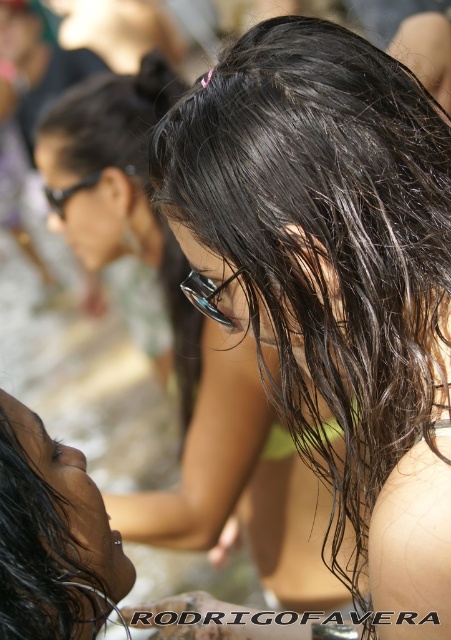
You are a photographer trying to capture a closeup of the clear plastic goggles at center and the white matte bikini top at center. Which object should you zoom in on to ensure both fit in the frame without cropping?

The clear plastic goggles at center has a lesser width compared to white matte bikini top at center, so you should zoom in on the white matte bikini top at center to ensure both objects fit in the frame without cropping.

You are a photographer trying to capture both the shiny black hair at lower left and the clear plastic goggles at center in a single frame. Which object should you focus on first if you want to ensure both are in focus, considering their sizes?

The shiny black hair at lower left is larger in size than the clear plastic goggles at center, so you should focus on the shiny black hair at lower left first to ensure both are in focus.

You are a photographer trying to capture a candid shot of the shiny black hair at lower left and the clear plastic goggles at center. The camera has a focus range of 12 inches. Can you fit both objects in the frame without moving the camera?

The shiny black hair at lower left and clear plastic goggles at center are 12.59 inches apart, which is slightly beyond the camera focus range of 12 inches. Therefore, you cannot fit both objects in the frame without moving the camera.